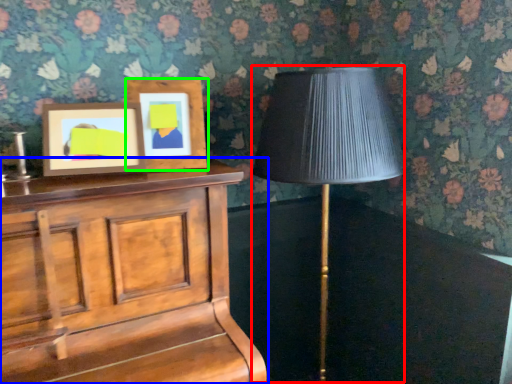
Question: Considering the real-world distances, which object is closest to table lamp (highlighted by a red box)? furniture (highlighted by a blue box) or picture frame (highlighted by a green box).

Choices:
 (A) furniture
 (B) picture frame

Answer: (B)